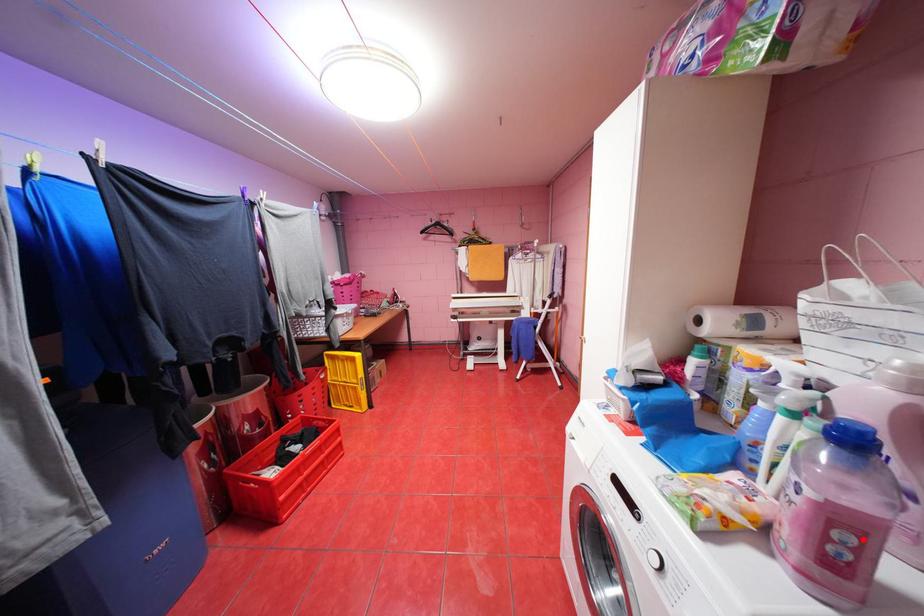
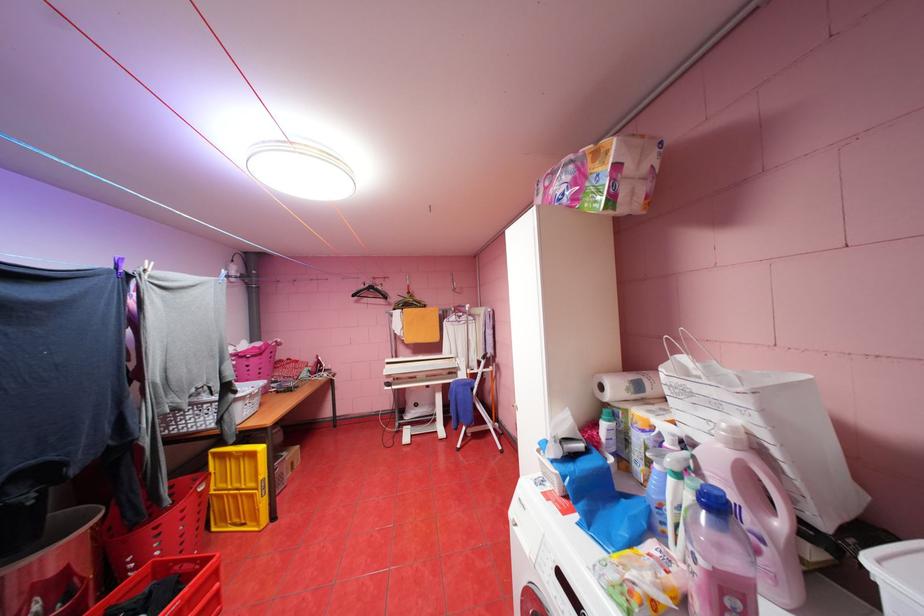
Question: I am providing you with two images of the same scene from different viewpoints. A red point is marked on the first image. Is the red point's position out of view in image 2?

Choices:
 (A) Yes
 (B) No

Answer: (B)